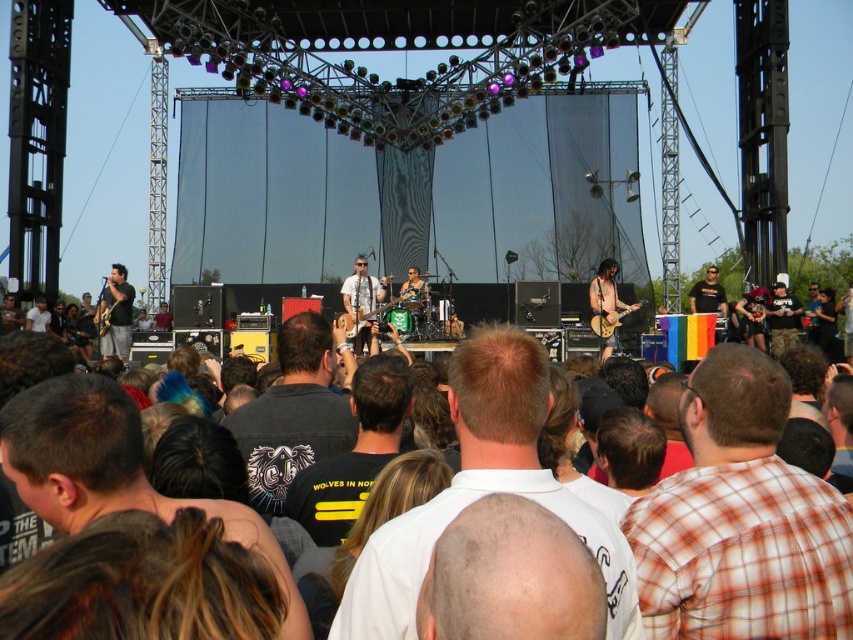
Consider the image. Between white shirt at center and black t-shirt at center, which one appears on the right side from the viewer's perspective?

From the viewer's perspective, black t-shirt at center appears more on the right side.

What do you see at coordinates (483, 492) in the screenshot? I see `white shirt at center` at bounding box center [483, 492].

Where is `white shirt at center`? white shirt at center is located at coordinates (483, 492).

Is bald head at center shorter than black t-shirt at center?

No.

Does bald head at center appear on the left side of black t-shirt at center?

Correct, you'll find bald head at center to the left of black t-shirt at center.

At what (x,y) coordinates should I click in order to perform the action: click on bald head at center. Please return your answer as a coordinate pair (x, y). This screenshot has height=640, width=853. Looking at the image, I should click on (509, 577).

Locate an element on the screen. bald head at center is located at coordinates (509, 577).

Can you confirm if black leather jacket at center is taller than shiny brown guitar at center?

Yes, black leather jacket at center is taller than shiny brown guitar at center.

Does black leather jacket at center appear under shiny brown guitar at center?

Indeed, black leather jacket at center is positioned under shiny brown guitar at center.

Locate an element on the screen. This screenshot has width=853, height=640. black leather jacket at center is located at coordinates (293, 413).

Locate an element on the screen. The width and height of the screenshot is (853, 640). black leather jacket at center is located at coordinates (293, 413).